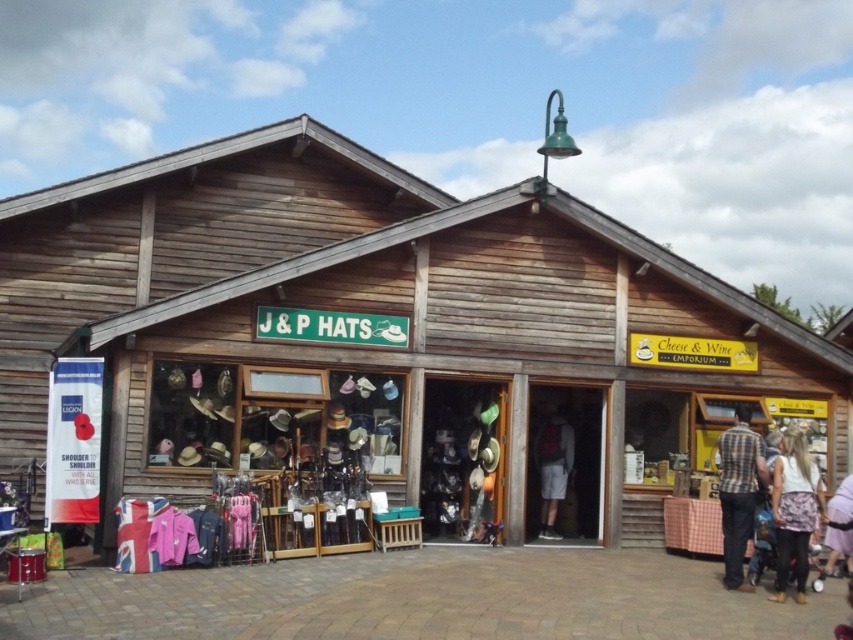
You are a customer looking to buy a new outfit. You see a floral skirt at lower right and dark gray fabric shorts at center. Which item is wider?

The floral skirt at lower right is wider than the dark gray fabric shorts at center.

You are a customer standing in front of the wooden building at center and the plaid shirt at center. Which object is taller?

The wooden building at center is much taller than the plaid shirt at center.